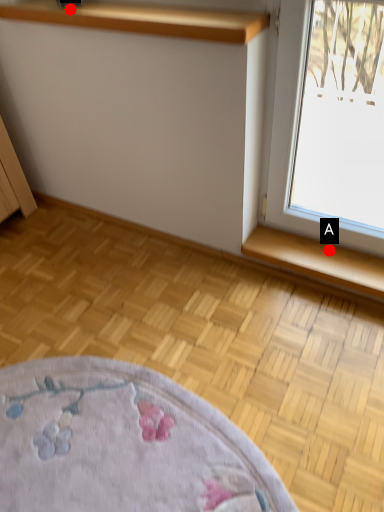
Question: Two points are circled on the image, labeled by A and B beside each circle. Which point is closer to the camera taking this photo?

Choices:
 (A) A is closer
 (B) B is closer

Answer: (B)